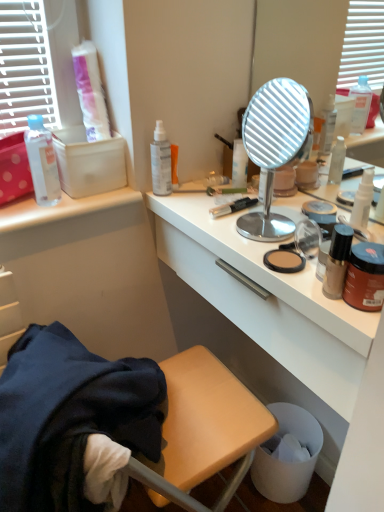
Question: Considering the positions of point (213, 231) and point (317, 440), is point (213, 231) closer or farther from the camera than point (317, 440)?

Choices:
 (A) farther
 (B) closer

Answer: (B)

Question: In terms of height, does white glossy desk at center look taller or shorter compared to white plastic trash can at lower right?

Choices:
 (A) short
 (B) tall

Answer: (A)

Question: Estimate the real-world distances between objects in this image. Which object is closer to the transparent plastic spray bottle at upper center, placed as the 4th bottle when sorted from front to back?

Choices:
 (A) wooden stool at lower left
 (B) white glossy desk at center
 (C) metallic round mirror at center
 (D) white glossy spray bottle at upper right, which is counted as the fourth bottle, starting from the left
 (E) brown matte jar at right

Answer: (B)

Question: Which is farther from the metallic round mirror at center?

Choices:
 (A) white cardboard box at upper left
 (B) transparent plastic spray bottle at upper center, acting as the second bottle starting from the left
 (C) transparent plastic bottle at upper left, the 4th bottle positioned from the right
 (D) brown matte jar at right
 (E) wooden stool at lower left

Answer: (E)